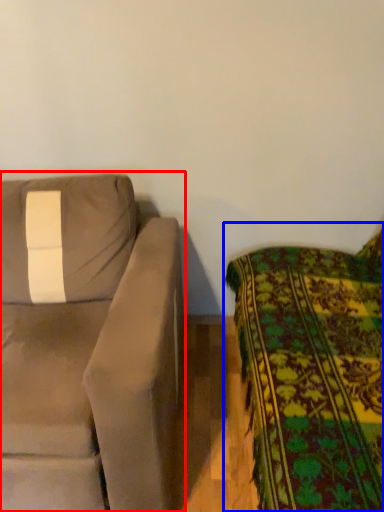
Question: Which object is closer to the camera taking this photo, studio couch (highlighted by a red box) or studio couch (highlighted by a blue box)?

Choices:
 (A) studio couch
 (B) studio couch

Answer: (B)